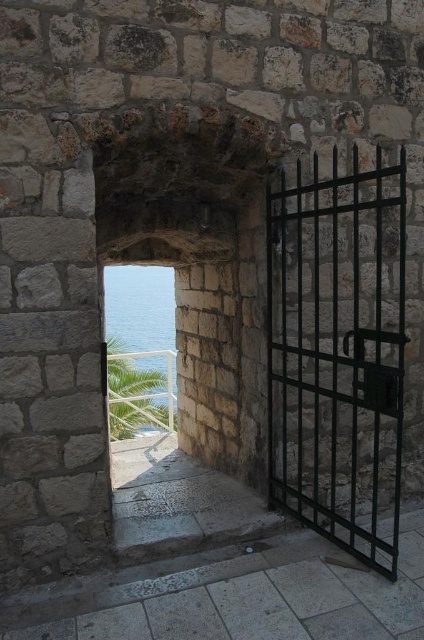
You are a painter standing at the entrance of the stone archway. You want to paint the black metal gate at right and the clear blue water at center. Which object should you focus on first if you want to paint the narrower one first?

The black metal gate at right is thinner than the clear blue water at center, so you should focus on painting the black metal gate at right first since it is narrower.

You are standing at the center of the stone archway. You notice a point marked at coordinates (x=339, y=352). What object is located at that point?

The black metal gate at right is located at point (x=339, y=352).

You are standing at the entrance of the stone archway. You see the black metal gate at right and the clear blue water at center. Which object is closer to you?

The black metal gate at right is closer to you because it is in front of the clear blue water at center.